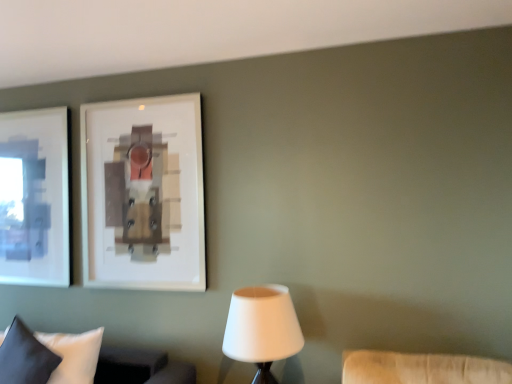
Question: Is dark blue fabric pillow at lower left smaller than white fabric pillow at lower left?

Choices:
 (A) no
 (B) yes

Answer: (B)

Question: Could white fabric pillow at lower left be considered to be inside dark blue fabric pillow at lower left?

Choices:
 (A) no
 (B) yes

Answer: (A)

Question: Is dark blue fabric pillow at lower left looking in the opposite direction of white fabric pillow at lower left?

Choices:
 (A) yes
 (B) no

Answer: (A)

Question: Is dark blue fabric pillow at lower left not inside white fabric pillow at lower left?

Choices:
 (A) yes
 (B) no

Answer: (B)

Question: Considering the relative sizes of dark blue fabric pillow at lower left and white fabric pillow at lower left in the image provided, is dark blue fabric pillow at lower left thinner than white fabric pillow at lower left?

Choices:
 (A) yes
 (B) no

Answer: (A)

Question: Does dark blue fabric pillow at lower left appear on the left side of white fabric pillow at lower left?

Choices:
 (A) yes
 (B) no

Answer: (A)

Question: Is white matte lampshade at lower center bigger than white fabric pillow at lower left?

Choices:
 (A) yes
 (B) no

Answer: (A)

Question: Is white matte lampshade at lower center looking in the opposite direction of white fabric pillow at lower left?

Choices:
 (A) no
 (B) yes

Answer: (A)

Question: Can you confirm if white matte lampshade at lower center is positioned to the right of white fabric pillow at lower left?

Choices:
 (A) no
 (B) yes

Answer: (B)

Question: Can you confirm if white matte lampshade at lower center is positioned to the left of white fabric pillow at lower left?

Choices:
 (A) yes
 (B) no

Answer: (B)

Question: Does white matte lampshade at lower center have a smaller size compared to white fabric pillow at lower left?

Choices:
 (A) no
 (B) yes

Answer: (A)

Question: From the image's perspective, does white matte lampshade at lower center appear lower than white fabric pillow at lower left?

Choices:
 (A) yes
 (B) no

Answer: (B)

Question: Can we say dark blue fabric pillow at lower left lies outside white matte lampshade at lower center?

Choices:
 (A) yes
 (B) no

Answer: (A)